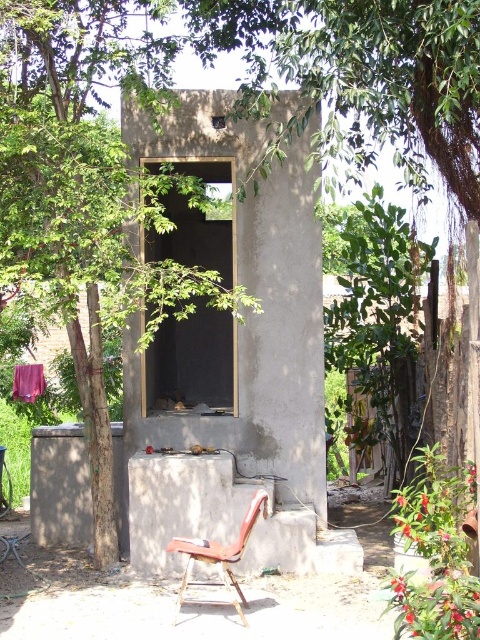
You are a painter who needs to set up an easel between the gray concrete hut at center and the green leafy tree at right. Can you fit your 1.5 meter wide easel in the space between them?

The gray concrete hut at center might be wider than green leafy tree at right, so the space between them is uncertain. It is possible the easel may not fit properly.

You are a painter who needs to set up an easel between the green leafy tree at center and the purple fabric at center. Since the ground is uneven, you want to place the easel on the wider side to ensure stability. Which object should you position your easel next to?

The green leafy tree at center is wider than the purple fabric at center, so you should position your easel next to the green leafy tree at center for better stability.

You are standing in front of the unfinished concrete structure and want to place a small potted plant between the two points labeled point [232,157] and point [349,241]. Which point should the plant be closer to if you want it to be nearer to the camera?

The plant should be placed closer to point [232,157] because it is closer to the camera than point [349,241].